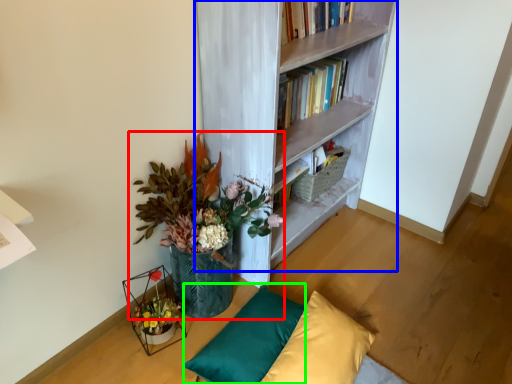
Question: Considering the real-world distances, which object is closest to houseplant (highlighted by a red box)? bookcase (highlighted by a blue box) or pillow (highlighted by a green box).

Choices:
 (A) bookcase
 (B) pillow

Answer: (A)